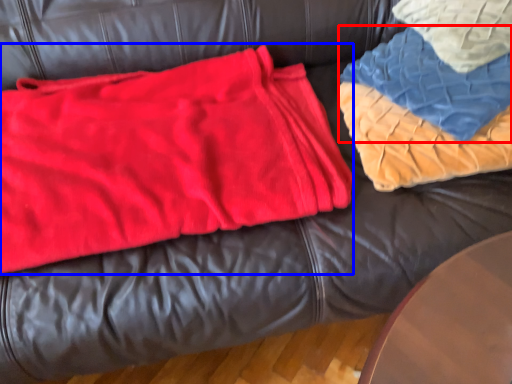
Question: Among these objects, which one is nearest to the camera, blanket (highlighted by a red box) or bean bag chair (highlighted by a blue box)?

Choices:
 (A) blanket
 (B) bean bag chair

Answer: (B)